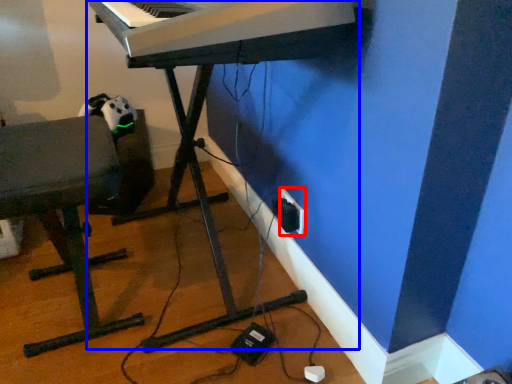
Question: Which object appears closest to the camera in this image, electric outlet (highlighted by a red box) or piano (highlighted by a blue box)?

Choices:
 (A) electric outlet
 (B) piano

Answer: (B)